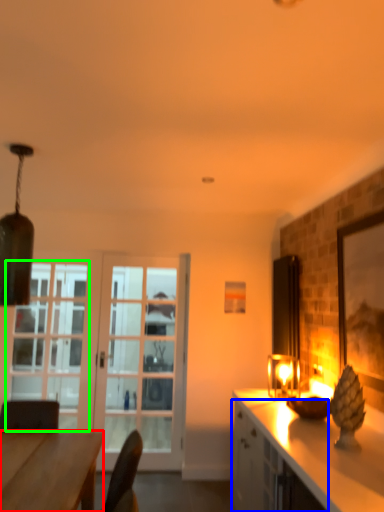
Question: Considering the real-world distances, which object is farthest from desk (highlighted by a red box)? cabinetry (highlighted by a blue box) or window (highlighted by a green box)?

Choices:
 (A) cabinetry
 (B) window

Answer: (B)